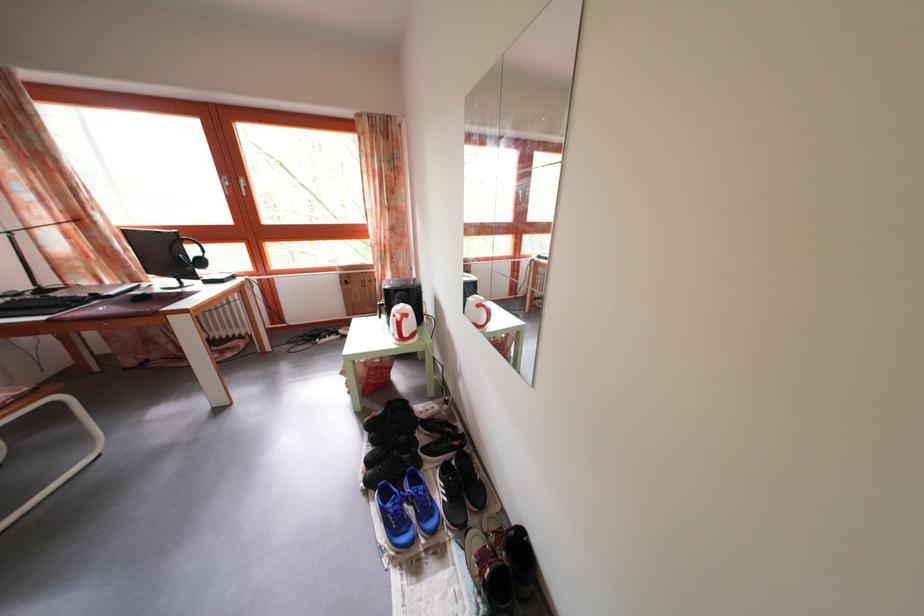
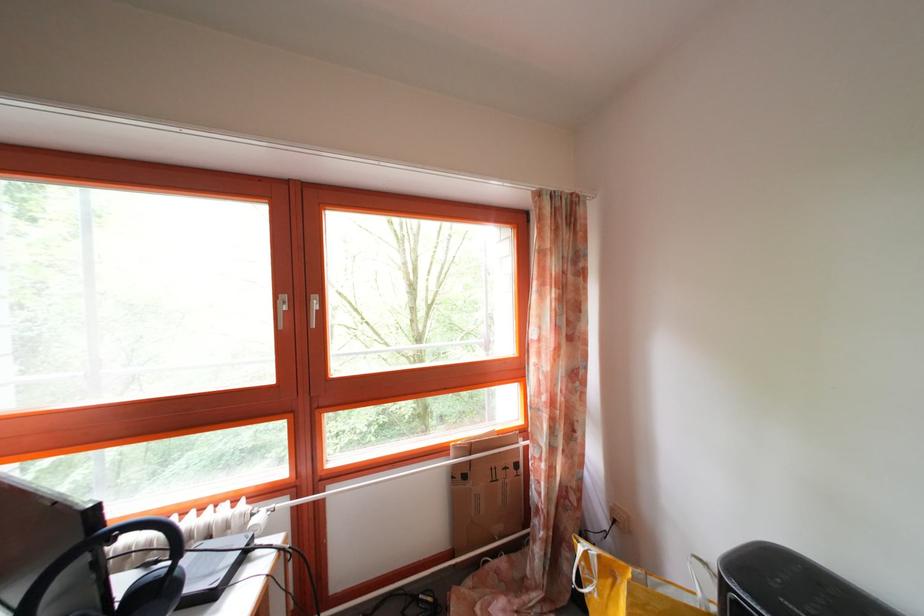
The point at (354,290) is marked in the first image. Where is the corresponding point in the second image?

(472, 484)